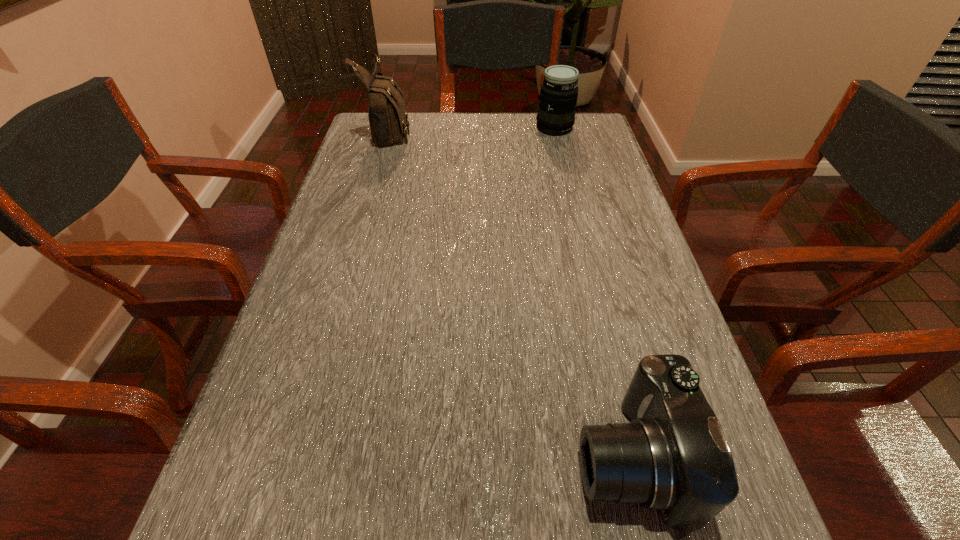
Locate an element on the screen. The width and height of the screenshot is (960, 540). shoulder bag that is at the far edge is located at coordinates (388, 118).

At what (x,y) coordinates should I click in order to perform the action: click on telephoto lens that is positioned at the far edge. Please return your answer as a coordinate pair (x, y). Image resolution: width=960 pixels, height=540 pixels. Looking at the image, I should click on (558, 96).

Find the location of a particular element. object located in the left edge section of the desktop is located at coordinates (388, 118).

The image size is (960, 540). In order to click on telephoto lens that is at the right edge in this screenshot , I will do `click(558, 96)`.

Find the location of a particular element. The image size is (960, 540). camera that is at the right edge is located at coordinates (673, 457).

Identify the location of object that is positioned at the far left corner. Image resolution: width=960 pixels, height=540 pixels. (388, 118).

Image resolution: width=960 pixels, height=540 pixels. I want to click on object at the far right corner, so click(x=558, y=96).

Image resolution: width=960 pixels, height=540 pixels. In the image, there is a desktop. In order to click on free space at the far edge in this screenshot , I will do `click(412, 149)`.

Where is `free space at the left edge of the desktop`? The image size is (960, 540). free space at the left edge of the desktop is located at coordinates (354, 157).

I want to click on free region at the right edge of the desktop, so click(625, 393).